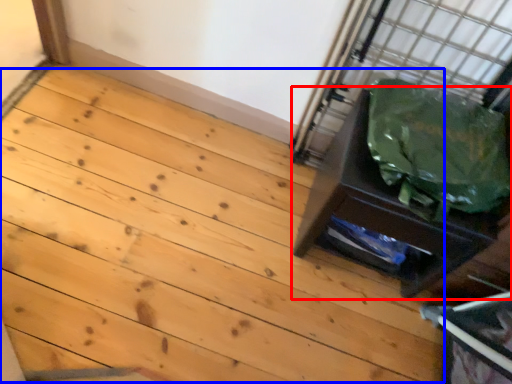
Question: Among these objects, which one is nearest to the camera, furniture (highlighted by a red box) or stairwell (highlighted by a blue box)?

Choices:
 (A) furniture
 (B) stairwell

Answer: (B)